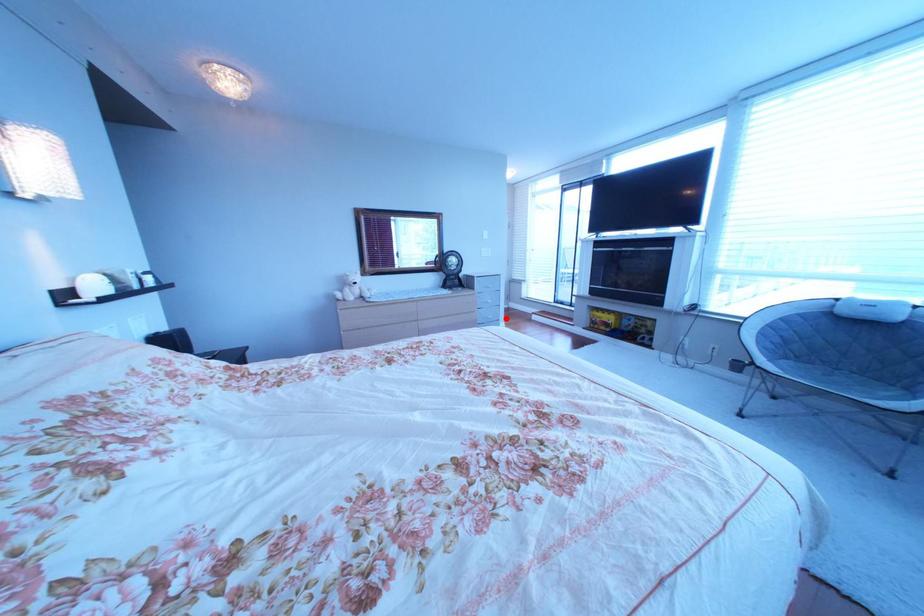
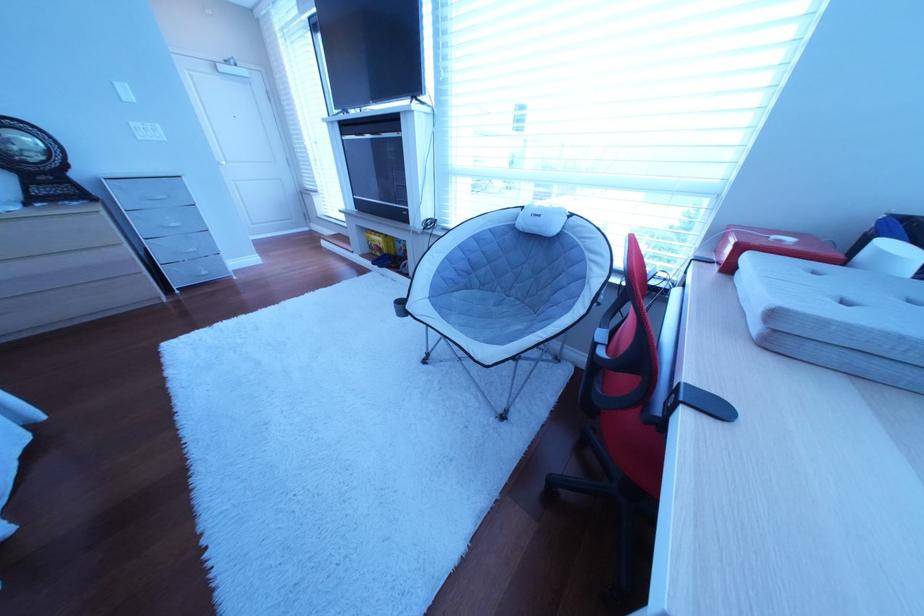
Question: I am providing you with two images of the same scene from different viewpoints. A red point is shown in image1. For the corresponding object point in image2, is it positioned nearer or farther from the camera?

Choices:
 (A) Nearer
 (B) Farther

Answer: (A)